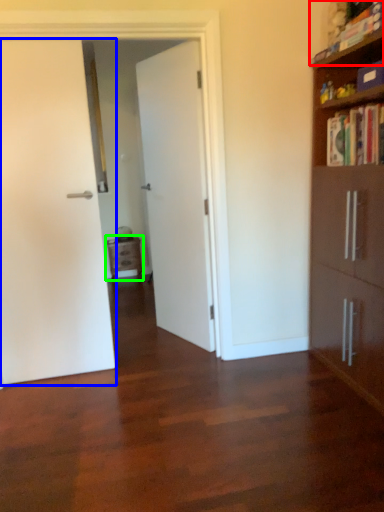
Question: Which is farther away from book (highlighted by a red box)? door (highlighted by a blue box) or nightstand (highlighted by a green box)?

Choices:
 (A) door
 (B) nightstand

Answer: (B)